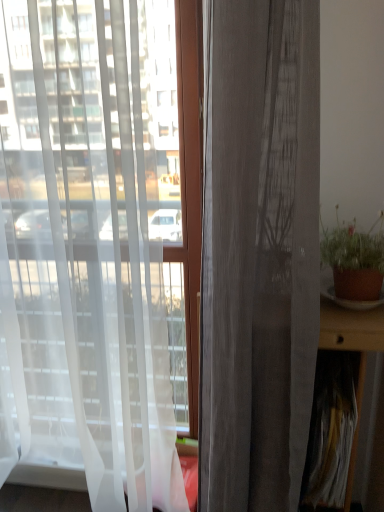
Question: Is white sheer curtain at left, arranged as the 1th curtain when viewed from the left, outside brown wooden table at right?

Choices:
 (A) yes
 (B) no

Answer: (A)

Question: Is white sheer curtain at left, arranged as the 1th curtain when viewed from the left, to the left of brown wooden table at right from the viewer's perspective?

Choices:
 (A) no
 (B) yes

Answer: (B)

Question: Considering the relative sizes of white sheer curtain at left, positioned as the second curtain in right-to-left order, and brown wooden table at right in the image provided, is white sheer curtain at left, positioned as the second curtain in right-to-left order, bigger than brown wooden table at right?

Choices:
 (A) yes
 (B) no

Answer: (A)

Question: Is brown wooden table at right surrounded by white sheer curtain at left, arranged as the 1th curtain when viewed from the left?

Choices:
 (A) no
 (B) yes

Answer: (A)

Question: From a real-world perspective, does white sheer curtain at left, arranged as the 1th curtain when viewed from the left, sit lower than brown wooden table at right?

Choices:
 (A) yes
 (B) no

Answer: (B)

Question: In terms of width, does matte gray curtain at center, the 1th curtain in the right-to-left sequence, look wider or thinner when compared to brown clay pot at right?

Choices:
 (A) wide
 (B) thin

Answer: (A)

Question: Considering the positions of point (233, 316) and point (331, 241), is point (233, 316) closer or farther from the camera than point (331, 241)?

Choices:
 (A) closer
 (B) farther

Answer: (A)

Question: From a real-world perspective, relative to brown clay pot at right, is matte gray curtain at center, which is the 2th curtain in left-to-right order, vertically above or below?

Choices:
 (A) below
 (B) above

Answer: (A)

Question: From their relative heights in the image, would you say matte gray curtain at center, the 1th curtain in the right-to-left sequence, is taller or shorter than brown clay pot at right?

Choices:
 (A) short
 (B) tall

Answer: (B)

Question: Considering the positions of brown clay pot at right and matte gray curtain at center, which is the 2th curtain in left-to-right order, in the image, is brown clay pot at right bigger or smaller than matte gray curtain at center, which is the 2th curtain in left-to-right order,?

Choices:
 (A) big
 (B) small

Answer: (B)

Question: From the image's perspective, is brown clay pot at right located above or below matte gray curtain at center, which is the 2th curtain in left-to-right order?

Choices:
 (A) above
 (B) below

Answer: (A)

Question: Does point (344, 271) appear closer or farther from the camera than point (278, 59)?

Choices:
 (A) farther
 (B) closer

Answer: (A)

Question: In terms of height, does brown clay pot at right look taller or shorter compared to matte gray curtain at center, which is the 2th curtain in left-to-right order?

Choices:
 (A) tall
 (B) short

Answer: (B)

Question: Is white sheer curtain at left, arranged as the 1th curtain when viewed from the left, in front of or behind brown clay pot at right in the image?

Choices:
 (A) behind
 (B) front

Answer: (B)

Question: Based on their sizes in the image, would you say white sheer curtain at left, arranged as the 1th curtain when viewed from the left, is bigger or smaller than brown clay pot at right?

Choices:
 (A) small
 (B) big

Answer: (B)